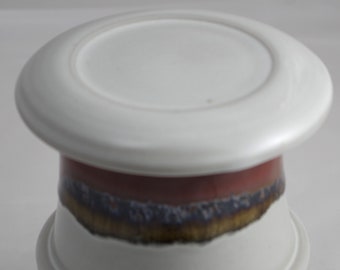
Locate an element on the screen. This screenshot has width=340, height=270. pedestal is located at coordinates (258, 240).